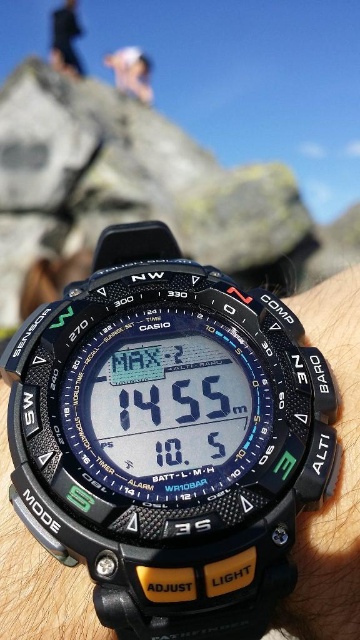
You are observing two people wearing the Casio Pathfinder watch in the image. One is labeled as the black fabric person at upper center and the other as the white fabric person at upper center. Based on their positions, which person is standing behind the other?

The black fabric person at upper center is much taller than the white fabric person at upper center, so the black fabric person at upper center is standing behind the white fabric person at upper center.

Looking at this image, you are a hiker who just arrived at a mountain trailhead. You have a Casio Pathfinder watch on your wrist and notice a person ahead. Based on the image, is the black rubber watch at lower right located below or above the black fabric person at upper center?

The black rubber watch at lower right is positioned under the black fabric person at upper center, so it is located below them.

You are a photographer trying to capture a group photo of two people wearing the Casio Pathfinder watch. The black fabric person at upper center and the white fabric person at upper center are part of the group. Given that the camera you are using has a maximum focus range of 6 inches, will you be able to focus on both individuals simultaneously?

The black fabric person at upper center and white fabric person at upper center are 7.14 inches apart from each other. Since the camera has a maximum focus range of 6 inches, the distance between them exceeds this range, so you cannot focus on both simultaneously.